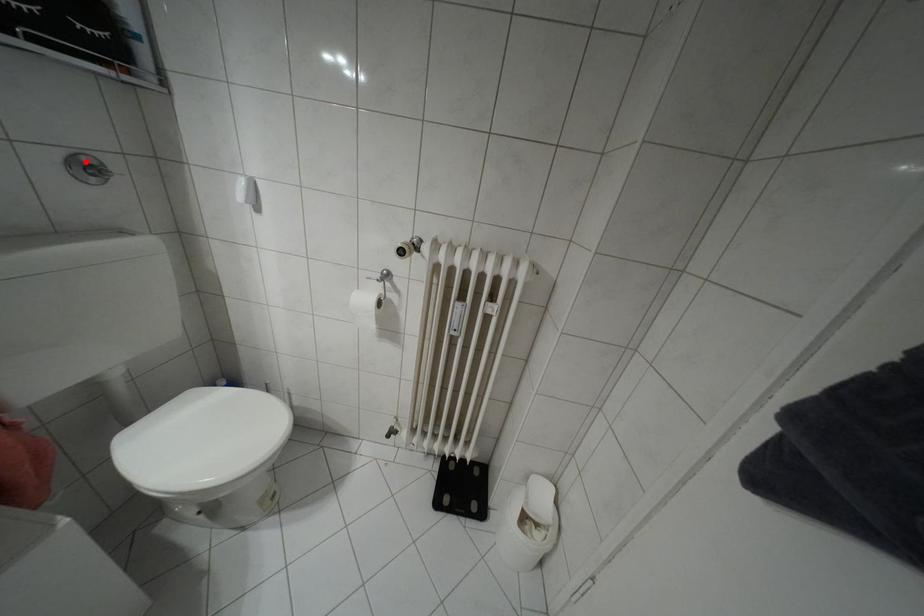
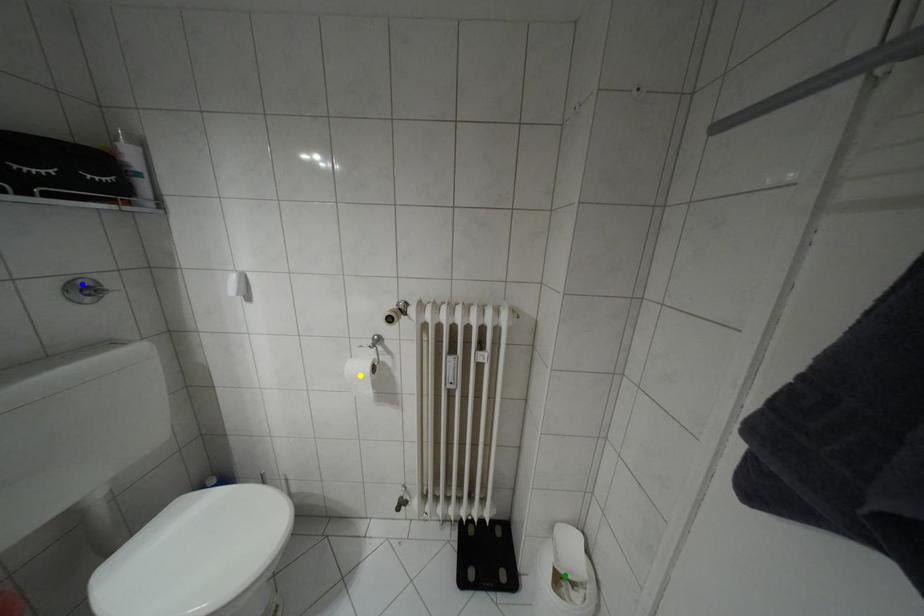
Question: I am providing you with two images of the same scene from different viewpoints. A red point is marked on the first image. You are given multiple points on the second image. Which point in image 2 represents the same 3d spot as the red point in image 1?

Choices:
 (A) green point
 (B) blue point
 (C) yellow point

Answer: (B)